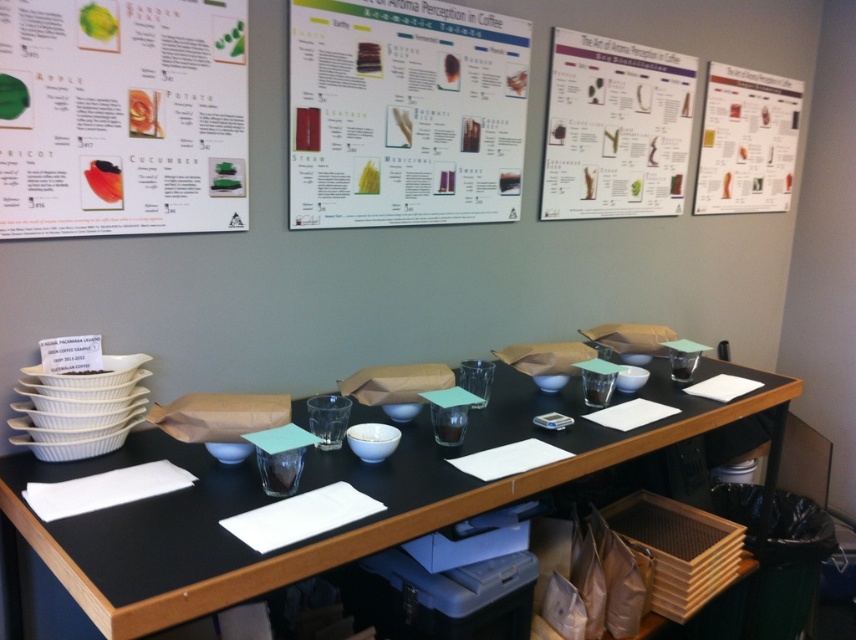
Describe the element at coordinates (403, 113) in the screenshot. The height and width of the screenshot is (640, 856). I see `white paperboard poster at upper center` at that location.

Can you confirm if white paperboard poster at upper center is smaller than white paper at upper center?

No, white paperboard poster at upper center is not smaller than white paper at upper center.

Is point (516, 128) positioned in front of point (605, 166)?

Yes, point (516, 128) is closer to viewer.

I want to click on white paperboard poster at upper center, so click(x=403, y=113).

Which is more to the right, white paper at upper center or matte paper poster at upper right?

matte paper poster at upper right

Between white paper at upper center and matte paper poster at upper right, which one has less height?

white paper at upper center is shorter.

At what (x,y) coordinates should I click in order to perform the action: click on white paper at upper center. Please return your answer as a coordinate pair (x, y). The image size is (856, 640). Looking at the image, I should click on (614, 129).

Which is more to the left, black matte table at center or white paperboard poster at upper center?

white paperboard poster at upper center

Identify the location of black matte table at center. This screenshot has height=640, width=856. (311, 488).

Where is `black matte table at center`? This screenshot has width=856, height=640. black matte table at center is located at coordinates (311, 488).

At what (x,y) coordinates should I click in order to perform the action: click on black matte table at center. Please return your answer as a coordinate pair (x, y). Image resolution: width=856 pixels, height=640 pixels. Looking at the image, I should click on (311, 488).